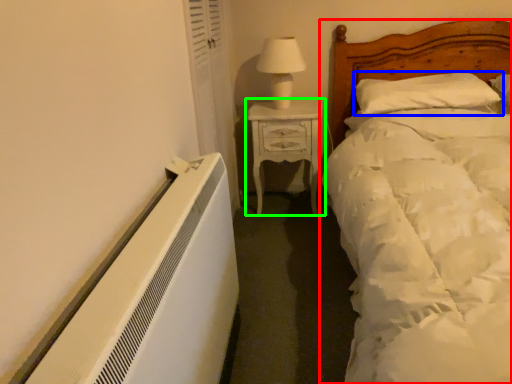
Question: Considering the real-world distances, which object is closest to bed (highlighted by a red box)? pillow (highlighted by a blue box) or nightstand (highlighted by a green box).

Choices:
 (A) pillow
 (B) nightstand

Answer: (A)